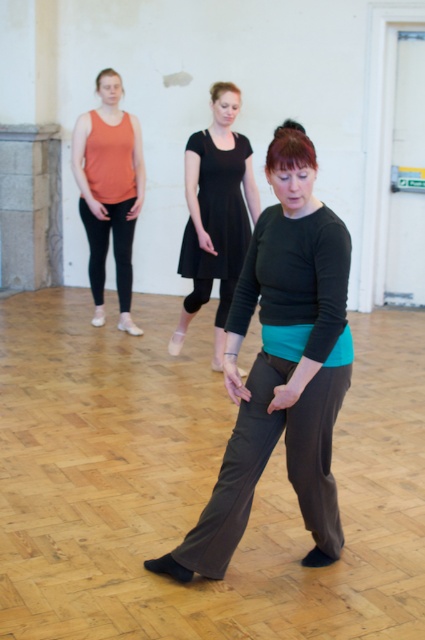
Does black matte dress at center have a greater width compared to matte orange tank top at left?

Correct, the width of black matte dress at center exceeds that of matte orange tank top at left.

Does black matte dress at center have a smaller size compared to matte orange tank top at left?

No, black matte dress at center is not smaller than matte orange tank top at left.

The height and width of the screenshot is (640, 425). Identify the location of black matte dress at center. (215, 212).

This screenshot has width=425, height=640. Identify the location of black matte dress at center. (215, 212).

Does matte black top at center come behind black matte dress at center?

No, matte black top at center is closer to the viewer.

Between matte black top at center and black matte dress at center, which one is positioned higher?

black matte dress at center is higher up.

Is point (257, 360) less distant than point (198, 268)?

Yes.

Find the location of `matte black top at center`. matte black top at center is located at coordinates (282, 368).

Who is positioned more to the right, matte black top at center or matte orange tank top at left?

Positioned to the right is matte black top at center.

Image resolution: width=425 pixels, height=640 pixels. I want to click on matte black top at center, so click(x=282, y=368).